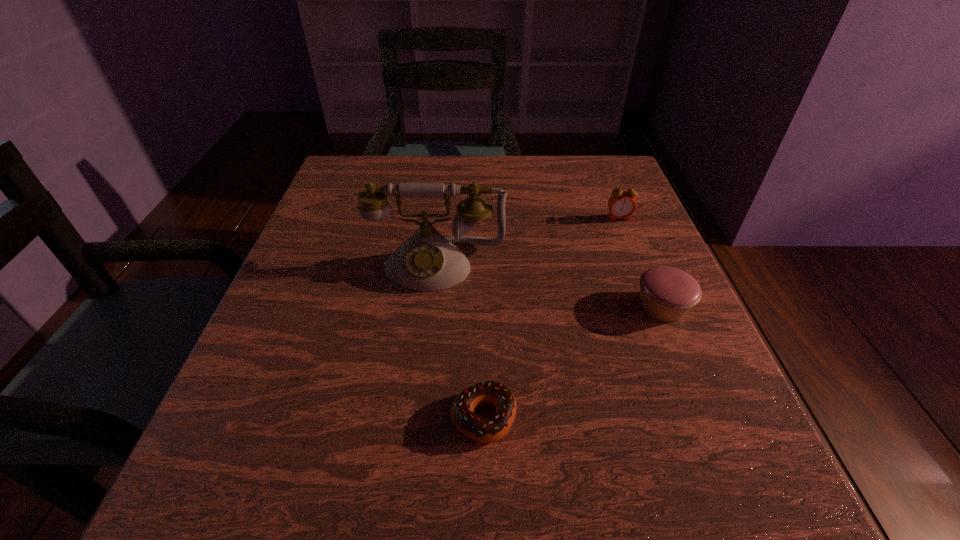
The width and height of the screenshot is (960, 540). I want to click on object that is the third closest to the telephone, so click(x=621, y=204).